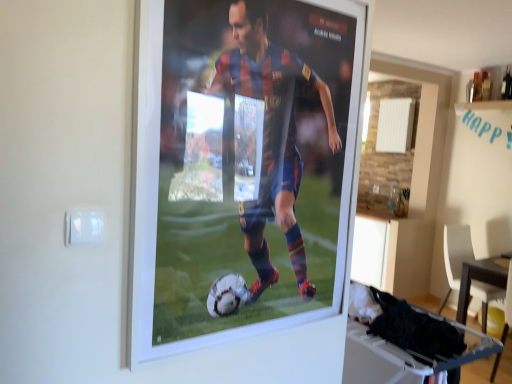
Question: Is point coord(461,332) positioned closer to the camera than point coord(505,259)?

Choices:
 (A) closer
 (B) farther

Answer: (A)

Question: From a real-world perspective, relative to wooden table at lower right, which is counted as the 2th table, starting from the top, is white plastic table at lower right, which ranks as the 1th table in front-to-back order, vertically above or below?

Choices:
 (A) above
 (B) below

Answer: (A)

Question: Estimate the real-world distances between objects in this image. Which object is farther from the white plastic chair at lower right?

Choices:
 (A) white plastic table at lower right, placed as the 2th table when sorted from back to front
 (B) wooden table at lower right, which is counted as the 2th table, starting from the top

Answer: (A)

Question: Which object is positioned closest to the white plastic chair at lower right?

Choices:
 (A) white plastic table at lower right, placed as the 1th table when sorted from top to bottom
 (B) wooden table at lower right, arranged as the 1th table when viewed from the right

Answer: (B)